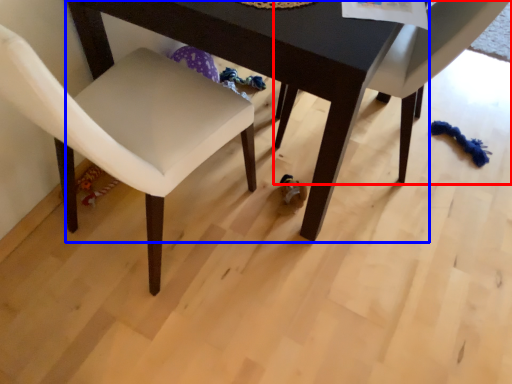
Question: Among these objects, which one is farthest to the camera, chair (highlighted by a red box) or table (highlighted by a blue box)?

Choices:
 (A) chair
 (B) table

Answer: (A)